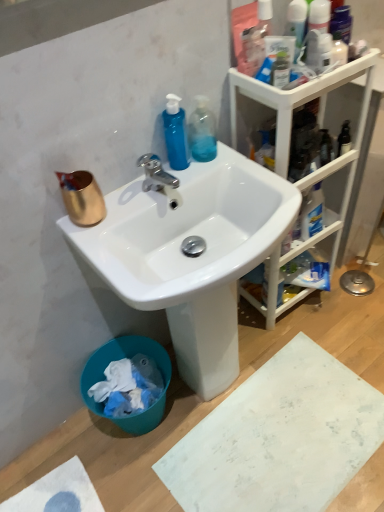
Identify the location of vacant space in white matte cardboard at lower right (from a real-world perspective). The width and height of the screenshot is (384, 512). (283, 451).